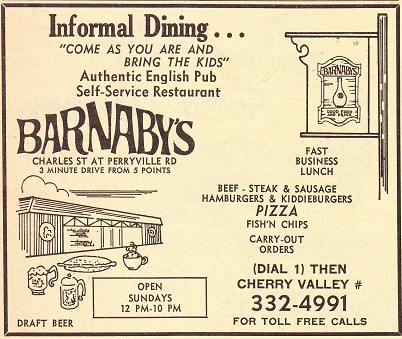
I want to click on beer stein, so click(x=71, y=286).